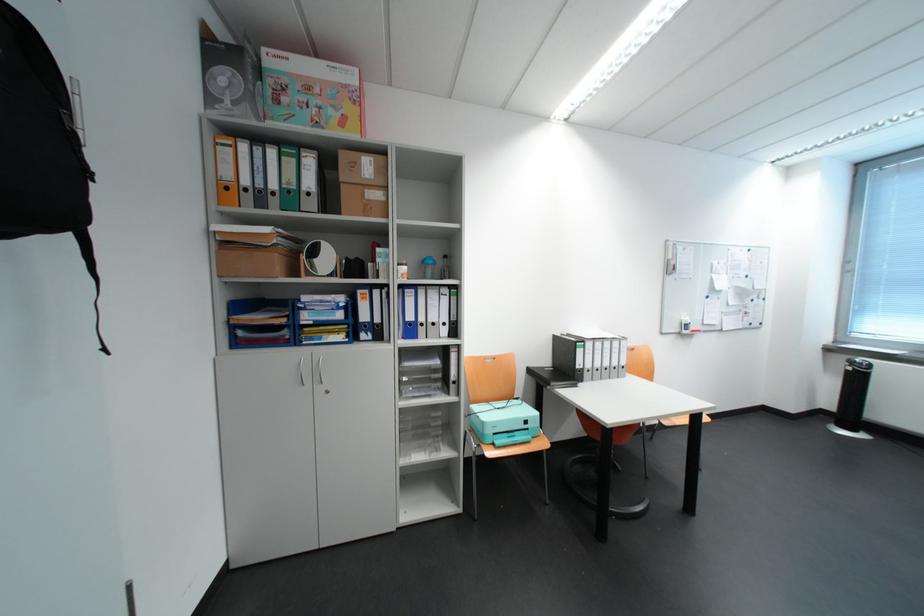
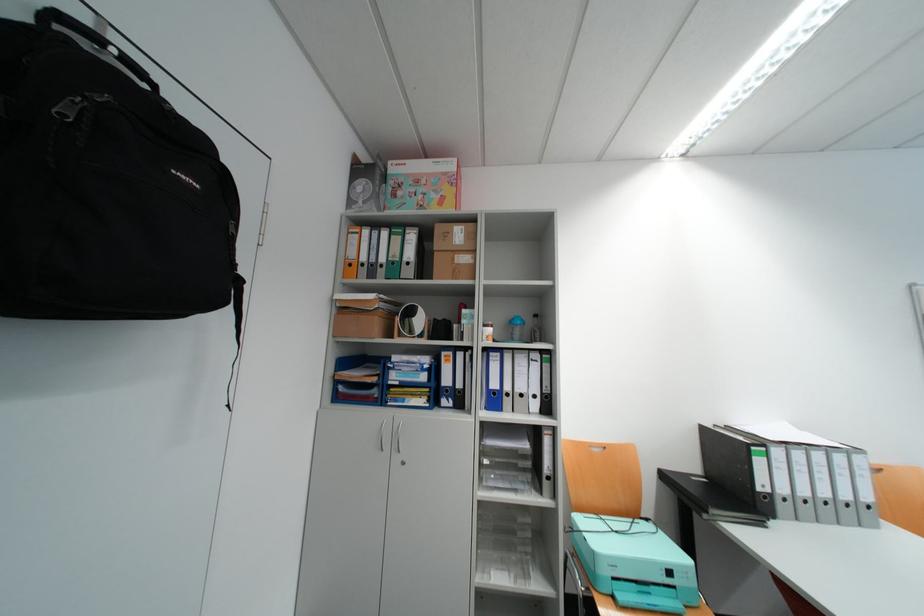
Where in the second image is the point corresponding to point (351, 215) from the first image?

(444, 280)